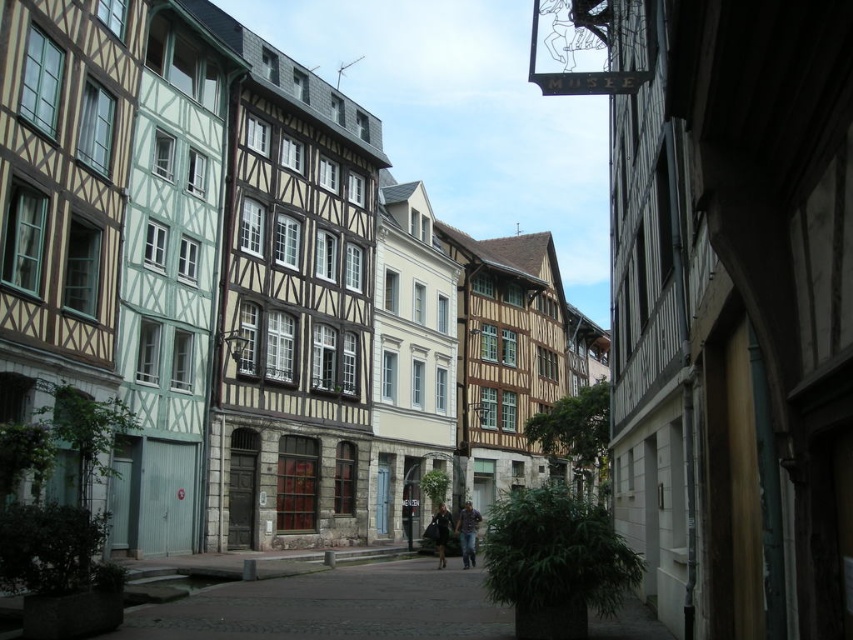
Who is more forward, (x=463, y=515) or (x=439, y=540)?

Point (x=439, y=540) is in front.

The image size is (853, 640). In order to click on denim jeans at center in this screenshot , I will do `click(468, 532)`.

Who is more distant from viewer, (465, 515) or (444, 525)?

Positioned behind is point (465, 515).

This screenshot has height=640, width=853. Find the location of `denim jeans at center`. denim jeans at center is located at coordinates 468,532.